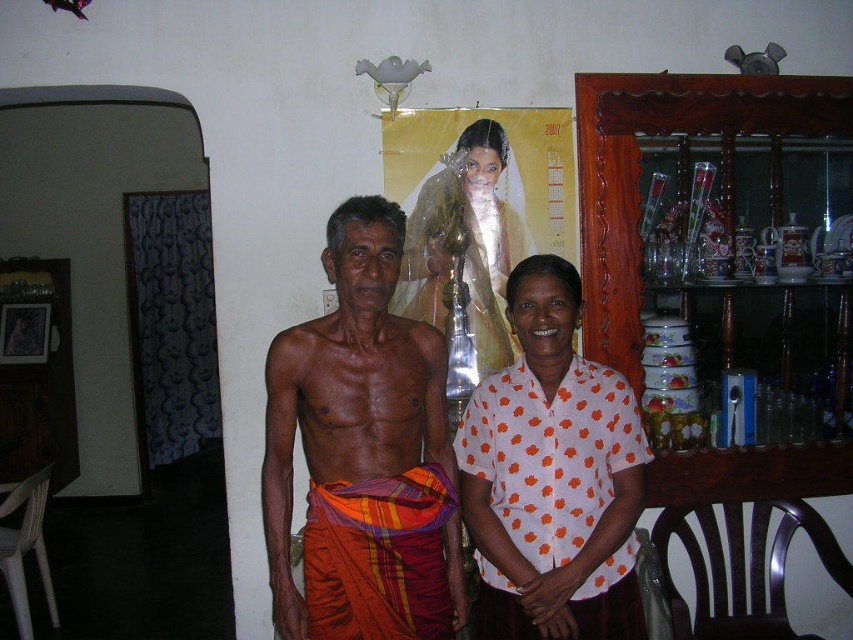
Question: Is orange woven cloth at center wider than white dotted shirt at center?

Choices:
 (A) yes
 (B) no

Answer: (A)

Question: Is white dotted shirt at center closer to the viewer compared to white satin dress at center?

Choices:
 (A) yes
 (B) no

Answer: (A)

Question: Which object is closer to the camera taking this photo?

Choices:
 (A) white satin dress at center
 (B) white dotted shirt at center
 (C) orange woven cloth at center

Answer: (C)

Question: Which point is farther from the camera taking this photo?

Choices:
 (A) (387, 259)
 (B) (456, 440)
 (C) (408, 240)

Answer: (C)

Question: Is white dotted shirt at center smaller than white satin dress at center?

Choices:
 (A) yes
 (B) no

Answer: (B)

Question: Considering the real-world distances, which object is farthest from the white dotted shirt at center?

Choices:
 (A) orange woven cloth at center
 (B) white satin dress at center

Answer: (B)